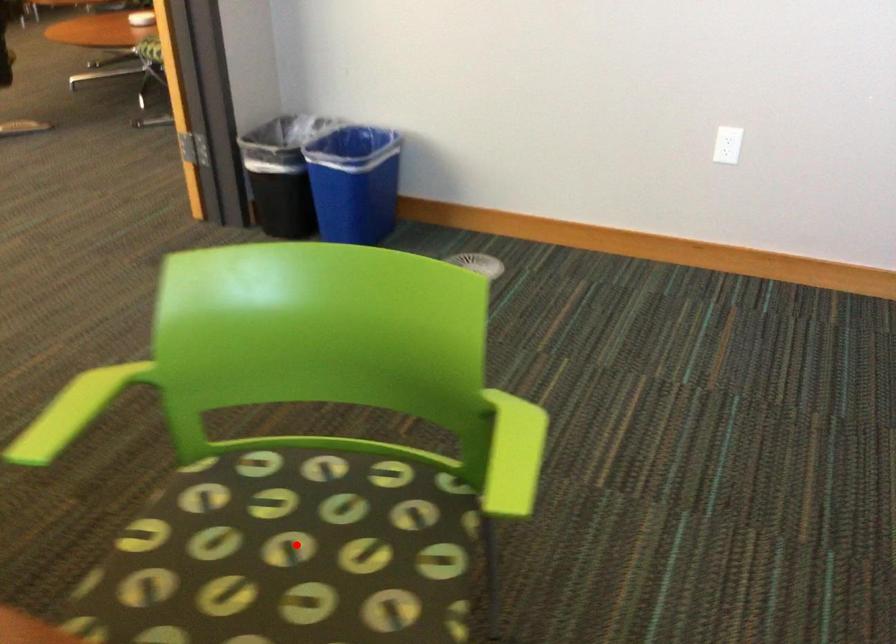
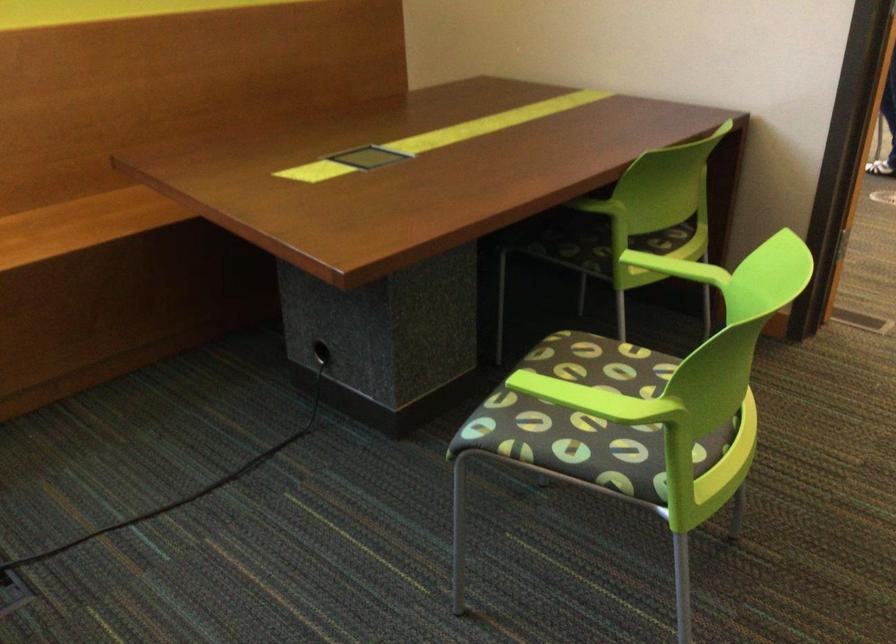
Question: I am providing you with two images of the same scene from different viewpoints. A red point is marked on the first image. Can you still see the location of the red point in image 2?

Choices:
 (A) Yes
 (B) No

Answer: (B)